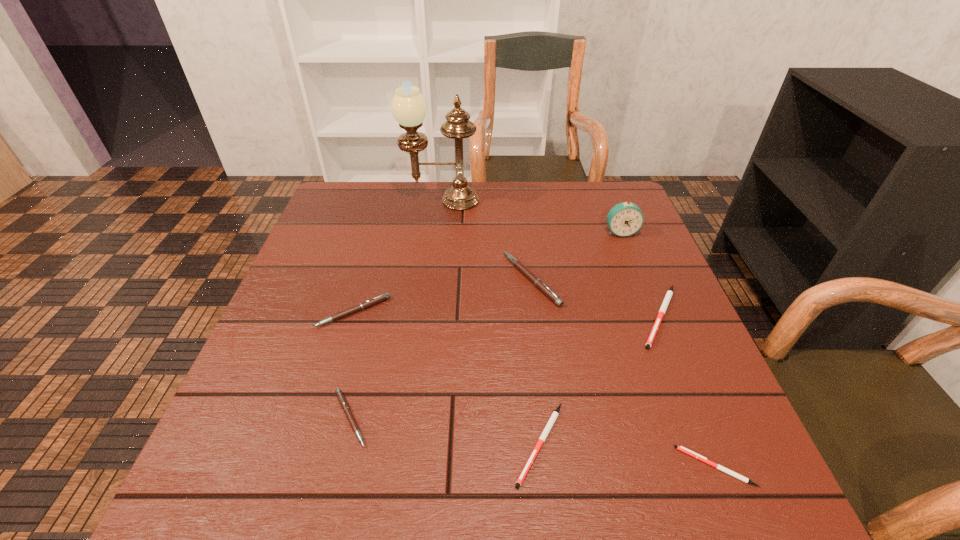
Where is `the tallest object`? the tallest object is located at coordinates (408, 107).

You are a GUI agent. You are given a task and a screenshot of the screen. Output one action in this format:
    pyautogui.click(x=<x>, y=<y>)
    Task: Click on the farthest object
    The height and width of the screenshot is (540, 960).
    Given the screenshot: What is the action you would take?
    pyautogui.click(x=408, y=107)

The height and width of the screenshot is (540, 960). I want to click on the second farthest object, so click(624, 219).

Image resolution: width=960 pixels, height=540 pixels. Identify the location of blue alarm clock. (624, 219).

Locate an element on the screen. The width and height of the screenshot is (960, 540). the rightmost pink pen is located at coordinates (538, 283).

The image size is (960, 540). I want to click on the third tallest object, so click(538, 283).

This screenshot has height=540, width=960. I want to click on the second smallest pink pen, so click(380, 298).

You are a GUI agent. You are given a task and a screenshot of the screen. Output one action in this format:
    pyautogui.click(x=<x>, y=<y>)
    Task: Click on the biggest white pen
    The height and width of the screenshot is (540, 960).
    Given the screenshot: What is the action you would take?
    pyautogui.click(x=669, y=293)

What are the coordinates of `the smallest pink pen` in the screenshot? It's located at (341, 398).

Image resolution: width=960 pixels, height=540 pixels. What are the coordinates of `the leftmost white pen` in the screenshot? It's located at (555, 414).